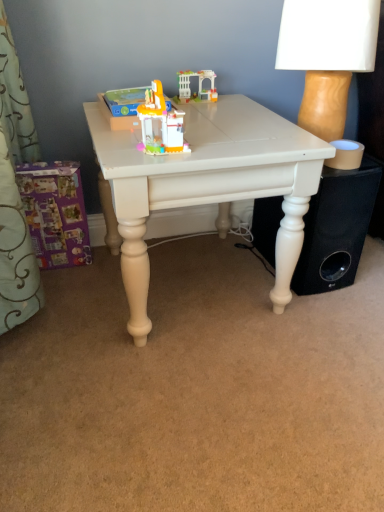
Question: Is purple cardboard box at lower left, the 1th toy positioned from the bottom, in front of black matte speaker at lower right?

Choices:
 (A) yes
 (B) no

Answer: (B)

Question: Is purple cardboard box at lower left, acting as the 2th toy starting from the back, further to the viewer compared to black matte speaker at lower right?

Choices:
 (A) yes
 (B) no

Answer: (A)

Question: Is purple cardboard box at lower left, arranged as the first toy when viewed from the left, oriented towards black matte speaker at lower right?

Choices:
 (A) yes
 (B) no

Answer: (B)

Question: Can you confirm if purple cardboard box at lower left, acting as the 2th toy starting from the back, is thinner than black matte speaker at lower right?

Choices:
 (A) yes
 (B) no

Answer: (A)

Question: Is purple cardboard box at lower left, acting as the 2th toy starting from the back, outside black matte speaker at lower right?

Choices:
 (A) yes
 (B) no

Answer: (A)

Question: Looking at the image, does translucent plastic toy at center, which is the 2th toy from right to left, seem bigger or smaller compared to white plastic arch at center, positioned as the 4th toy in front-to-back order?

Choices:
 (A) small
 (B) big

Answer: (B)

Question: Is point (155, 138) positioned closer to the camera than point (210, 75)?

Choices:
 (A) closer
 (B) farther

Answer: (A)

Question: From a real-world perspective, relative to white plastic arch at center, the fourth toy from the left, is translucent plastic toy at center, which ranks as the third toy in top-to-bottom order, vertically above or below?

Choices:
 (A) below
 (B) above

Answer: (B)

Question: In terms of width, does translucent plastic toy at center, which is counted as the 4th toy, starting from the back, look wider or thinner when compared to white plastic arch at center, positioned as the 4th toy in front-to-back order?

Choices:
 (A) thin
 (B) wide

Answer: (B)

Question: Considering the positions of black matte speaker at lower right and translucent plastic toy at center, which appears as the third toy when viewed from the left, in the image, is black matte speaker at lower right bigger or smaller than translucent plastic toy at center, which appears as the third toy when viewed from the left,?

Choices:
 (A) small
 (B) big

Answer: (B)

Question: From the image's perspective, is black matte speaker at lower right positioned above or below translucent plastic toy at center, which is the 2th toy from right to left?

Choices:
 (A) above
 (B) below

Answer: (B)

Question: From a real-world perspective, relative to translucent plastic toy at center, which is the 2th toy from right to left, is black matte speaker at lower right vertically above or below?

Choices:
 (A) above
 (B) below

Answer: (B)

Question: Choose the correct answer: Is black matte speaker at lower right inside translucent plastic toy at center, which is the second toy from bottom to top, or outside it?

Choices:
 (A) inside
 (B) outside

Answer: (B)

Question: Considering their positions, is purple cardboard box at lower left, acting as the 2th toy starting from the back, located in front of or behind black matte speaker at lower right?

Choices:
 (A) front
 (B) behind

Answer: (B)

Question: From a real-world perspective, is purple cardboard box at lower left, arranged as the first toy when viewed from the left, positioned above or below black matte speaker at lower right?

Choices:
 (A) below
 (B) above

Answer: (A)